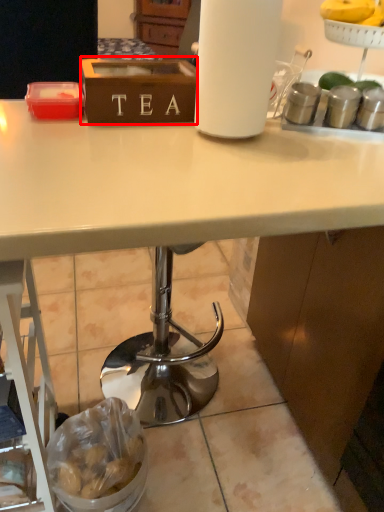
Question: From the image's perspective, what is the correct spatial relationship of box (annotated by the red box) in relation to food?

Choices:
 (A) below
 (B) above

Answer: (B)